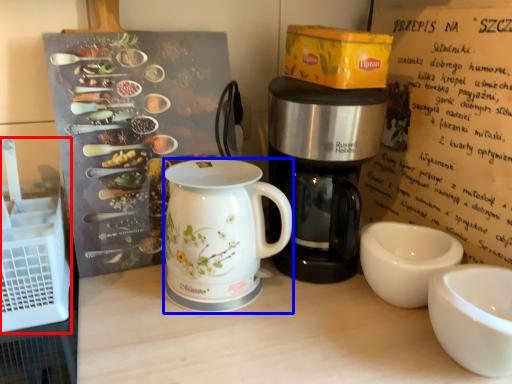
Question: Which point is further to the camera, crate (highlighted by a red box) or jug (highlighted by a blue box)?

Choices:
 (A) crate
 (B) jug

Answer: (B)